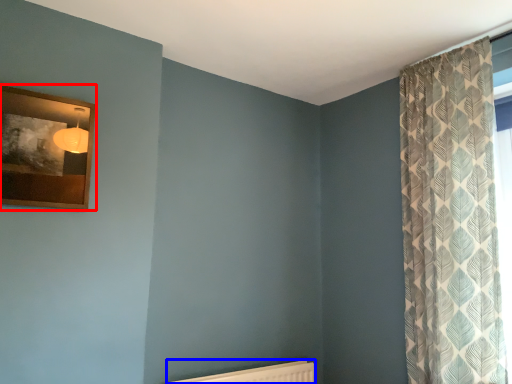
Question: Which of the following is the farthest to the observer, picture frame (highlighted by a red box) or radiator (highlighted by a blue box)?

Choices:
 (A) picture frame
 (B) radiator

Answer: (B)